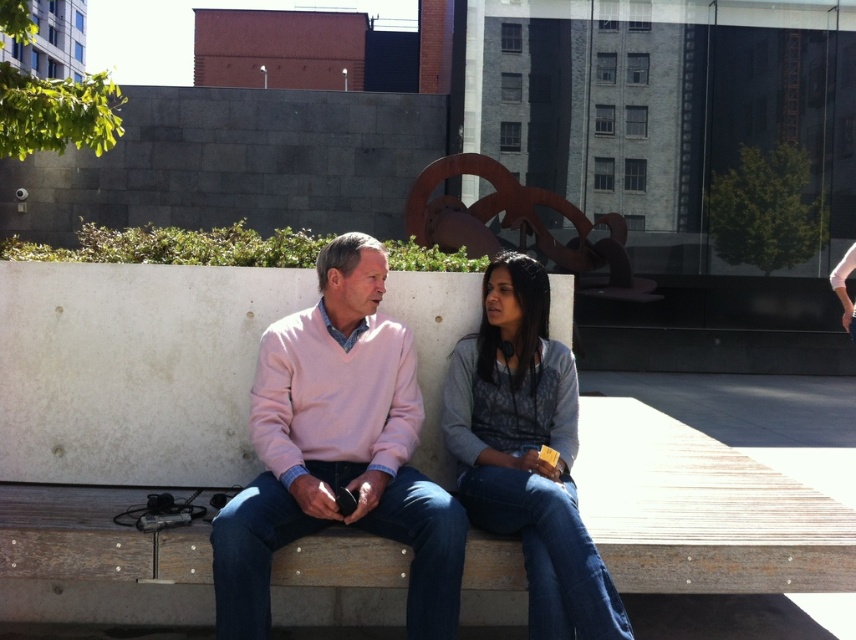
Does pink sweater at center have a greater width compared to denim jacket at center?

Yes, pink sweater at center is wider than denim jacket at center.

Can you confirm if pink sweater at center is positioned below denim jacket at center?

Incorrect, pink sweater at center is not positioned below denim jacket at center.

Locate an element on the screen. Image resolution: width=856 pixels, height=640 pixels. pink sweater at center is located at coordinates (337, 451).